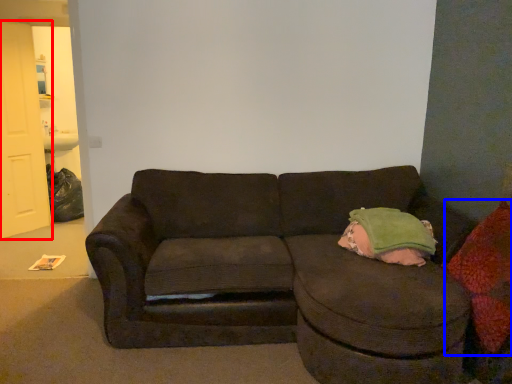
Question: Which object appears farthest to the camera in this image, door (highlighted by a red box) or throw pillow (highlighted by a blue box)?

Choices:
 (A) door
 (B) throw pillow

Answer: (A)